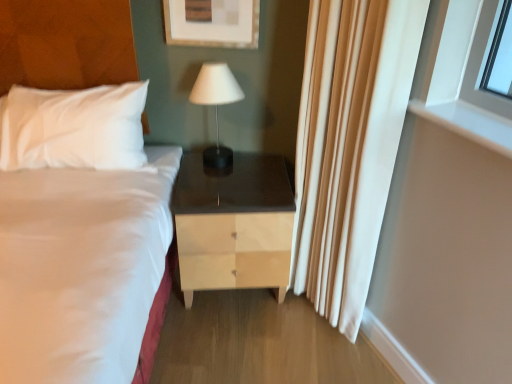
Describe the element at coordinates (234, 224) in the screenshot. I see `light wood/finish nightstand at center` at that location.

Measure the distance between point (x=217, y=148) and camera.

Point (x=217, y=148) is 2.10 meters from camera.

Locate an element on the screen. white glossy window at upper right is located at coordinates (460, 74).

Which object is closer to the camera taking this photo, white glossy window at upper right or white silky curtain at right?

white silky curtain at right is more forward.

How many degrees apart are the facing directions of white glossy window at upper right and white silky curtain at right?

The angular difference between white glossy window at upper right and white silky curtain at right is 90 degrees.

From the image's perspective, does white glossy window at upper right appear lower than white silky curtain at right?

Incorrect, from the image's perspective, white glossy window at upper right is higher than white silky curtain at right.

Which is more to the left, white glossy window at upper right or white silky curtain at right?

Positioned to the left is white silky curtain at right.

Which point is more forward, (216, 89) or (426, 39)?

The point (426, 39) is in front.

What's the angular difference between white matte table lamp at center and white glossy window at upper right's facing directions?

The angular difference between white matte table lamp at center and white glossy window at upper right is 19.2 degrees.

Does white matte table lamp at center contain white glossy window at upper right?

No, white glossy window at upper right is located outside of white matte table lamp at center.

Is there a large distance between white matte table lamp at center and white glossy window at upper right?

No, there isn't a large distance between white matte table lamp at center and white glossy window at upper right.

Does white matte table lamp at center turn towards light wood/finish nightstand at center?

No, white matte table lamp at center is not aimed at light wood/finish nightstand at center.

At what (x,y) coordinates should I click in order to perform the action: click on table lamp positioned vertically above the light wood/finish nightstand at center (from a real-world perspective). Please return your answer as a coordinate pair (x, y). Image resolution: width=512 pixels, height=384 pixels. Looking at the image, I should click on (216, 106).

Is white matte table lamp at center behind light wood/finish nightstand at center?

Yes, white matte table lamp at center is further from the viewer.

How many degrees apart are the facing directions of white matte table lamp at center and light wood/finish nightstand at center?

The facing directions of white matte table lamp at center and light wood/finish nightstand at center are 2.71 degrees apart.

Can you see light wood/finish nightstand at center touching white glossy window at upper right?

They are not placed beside each other.

Is light wood/finish nightstand at center thinner than white glossy window at upper right?

In fact, light wood/finish nightstand at center might be wider than white glossy window at upper right.

Can you confirm if light wood/finish nightstand at center is positioned to the right of white glossy window at upper right?

Incorrect, light wood/finish nightstand at center is not on the right side of white glossy window at upper right.

This screenshot has height=384, width=512. Find the location of `nightstand below the white glossy window at upper right (from the image's perspective)`. nightstand below the white glossy window at upper right (from the image's perspective) is located at coordinates (234, 224).

Is light wood/finish nightstand at center taller than white silky curtain at right?

Incorrect, the height of light wood/finish nightstand at center is not larger of that of white silky curtain at right.

Is light wood/finish nightstand at center outside of white silky curtain at right?

Indeed, light wood/finish nightstand at center is completely outside white silky curtain at right.

Does point (253, 245) appear closer or farther from the camera than point (390, 45)?

Clearly, point (253, 245) is more distant from the camera than point (390, 45).

Considering the sizes of white silky curtain at right and white matte table lamp at center in the image, is white silky curtain at right bigger or smaller than white matte table lamp at center?

white silky curtain at right is bigger than white matte table lamp at center.

Considering the sizes of white silky curtain at right and white matte table lamp at center in the image, is white silky curtain at right taller or shorter than white matte table lamp at center?

Considering their sizes, white silky curtain at right has more height than white matte table lamp at center.

Considering the positions of objects white silky curtain at right and white matte table lamp at center in the image provided, who is more to the left, white silky curtain at right or white matte table lamp at center?

From the viewer's perspective, white matte table lamp at center appears more on the left side.

Is white silky curtain at right not near white matte table lamp at center?

white silky curtain at right is actually quite close to white matte table lamp at center.

Does white matte table lamp at center come behind white silky curtain at right?

Yes, it is behind white silky curtain at right.

Between white matte table lamp at center and white silky curtain at right, which one has smaller size?

white matte table lamp at center is smaller.

Which object is positioned more to the left, white matte table lamp at center or white silky curtain at right?

white matte table lamp at center is more to the left.

From a real-world perspective, which object stands above the other?

white matte table lamp at center, from a real-world perspective.

The image size is (512, 384). Identify the location of curtain in front of the white glossy window at upper right. (349, 145).

Locate an element on the screen. Image resolution: width=512 pixels, height=384 pixels. table lamp that is below the white glossy window at upper right (from the image's perspective) is located at coordinates (216, 106).

When comparing their distances from white glossy window at upper right, does white silky curtain at right or white matte table lamp at center seem further?

The object further to white glossy window at upper right is white matte table lamp at center.

Considering their positions, is white glossy window at upper right positioned closer to light wood/finish nightstand at center than white matte table lamp at center?

The object closer to light wood/finish nightstand at center is white matte table lamp at center.

When comparing their distances from light wood/finish nightstand at center, does white silky curtain at right or white matte table lamp at center seem closer?

Among the two, white matte table lamp at center is located nearer to light wood/finish nightstand at center.

Which object lies further to the anchor point white silky curtain at right, white glossy window at upper right or white matte table lamp at center?

white matte table lamp at center lies further to white silky curtain at right than the other object.

Looking at the image, which one is located closer to white glossy window at upper right, light wood/finish nightstand at center or white matte table lamp at center?

Based on the image, light wood/finish nightstand at center appears to be nearer to white glossy window at upper right.

Based on the photo, which object lies nearer to the anchor point white glossy window at upper right, white silky curtain at right or light wood/finish nightstand at center?

Based on the image, white silky curtain at right appears to be nearer to white glossy window at upper right.

When comparing their distances from white silky curtain at right, does white glossy window at upper right or light wood/finish nightstand at center seem further?

light wood/finish nightstand at center.

Consider the image. From the image, which object appears to be nearer to white matte table lamp at center, white glossy window at upper right or light wood/finish nightstand at center?

light wood/finish nightstand at center.

Where is `nightstand located between white matte table lamp at center and white glossy window at upper right in the left-right direction`? The width and height of the screenshot is (512, 384). nightstand located between white matte table lamp at center and white glossy window at upper right in the left-right direction is located at coordinates (234, 224).

The width and height of the screenshot is (512, 384). In order to click on curtain between light wood/finish nightstand at center and white glossy window at upper right in this screenshot , I will do `click(349, 145)`.

Where is `nightstand located between white silky curtain at right and white matte table lamp at center in the depth direction`? Image resolution: width=512 pixels, height=384 pixels. nightstand located between white silky curtain at right and white matte table lamp at center in the depth direction is located at coordinates (234, 224).

Where is `curtain located between white matte table lamp at center and white glossy window at upper right in the left-right direction`? curtain located between white matte table lamp at center and white glossy window at upper right in the left-right direction is located at coordinates (349, 145).